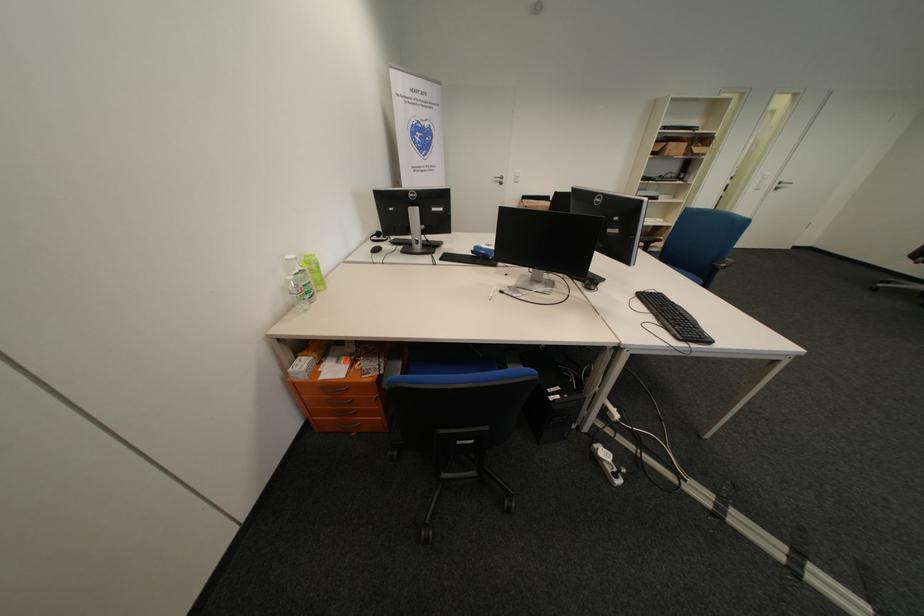
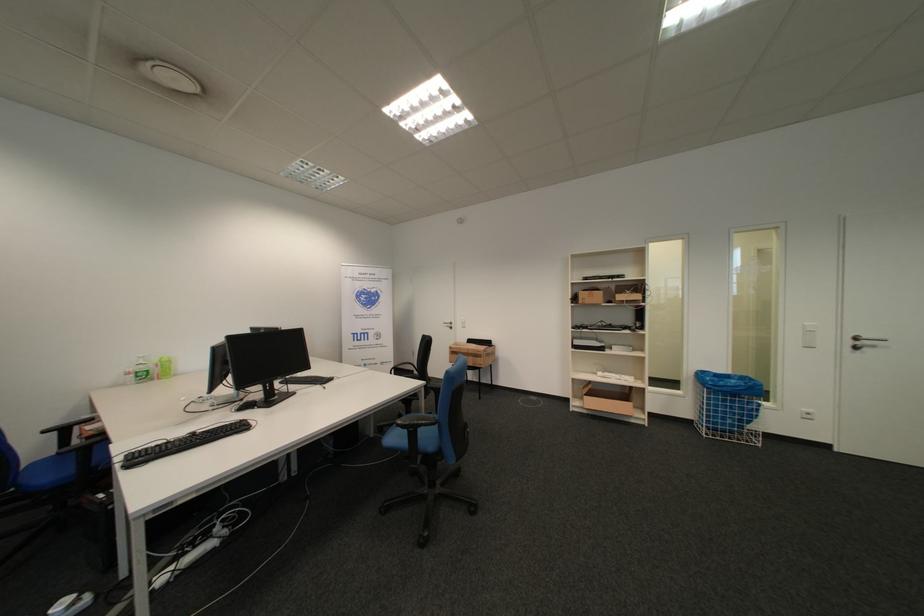
Locate, in the second image, the point that corresponds to (x=787, y=187) in the first image.

(862, 344)